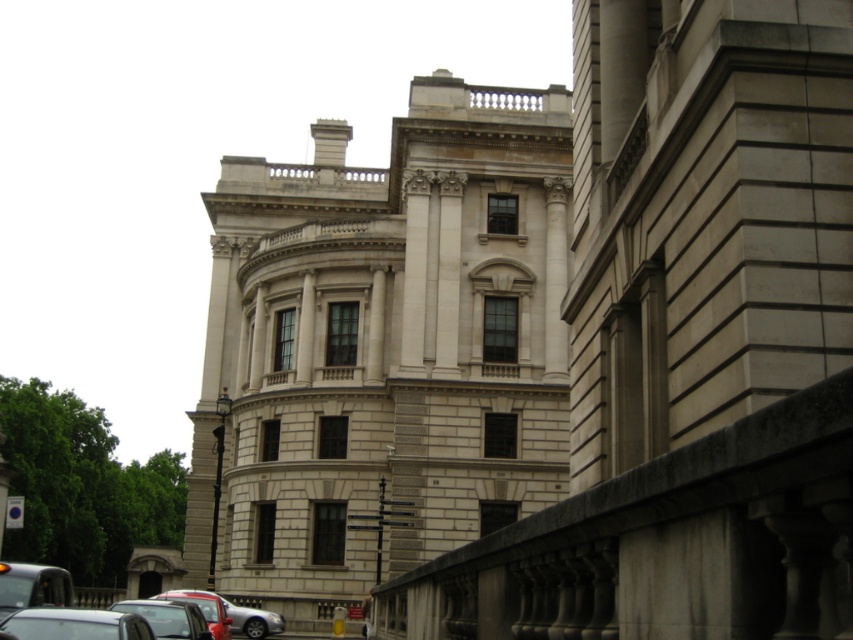
You are standing at the center of the image and want to move towards the matte black car at lower left. Which direction should you go?

The matte black car at lower left is located at point coordinates of 0.966 on the x axis and 0.198 on the y axis. Since the car is at lower left, you should move towards the lower left direction to reach it.

You are a pedestrian standing at the entrance of the grand classical building and see both the metallic silver car at lower left and the shiny red car at lower left. Which car is positioned higher relative to the other?

The metallic silver car at lower left is located above the shiny red car at lower left, so it is positioned higher.

You are standing in front of the grand classical building and see two cars, a metallic silver car at lower left and a shiny red car at lower left. Which car is nearer to you?

The metallic silver car at lower left is closer to the viewer than the shiny red car at lower left.